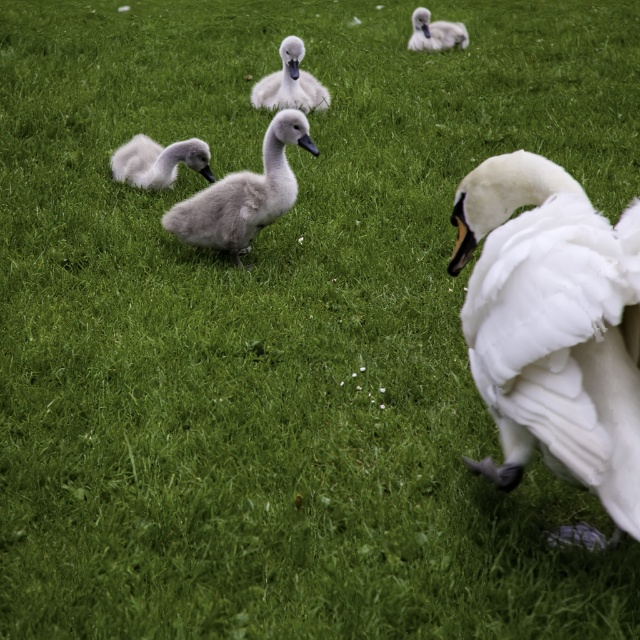
Consider the image. Does black glossy beak at center have a lesser width compared to gray matte beak at center?

No, black glossy beak at center is not thinner than gray matte beak at center.

Is point (301, 138) positioned after point (292, 72)?

No, (301, 138) is in front of (292, 72).

Locate an element on the screen. This screenshot has width=640, height=640. black glossy beak at center is located at coordinates (307, 145).

Describe the element at coordinates (554, 326) in the screenshot. This screenshot has height=640, width=640. I see `white fluffy swan at center` at that location.

Which is below, white fluffy swan at center or black glossy beak at center?

white fluffy swan at center

Between point (499, 205) and point (307, 140), which one is positioned in front?

Positioned in front is point (499, 205).

The height and width of the screenshot is (640, 640). Find the location of `white fluffy swan at center`. white fluffy swan at center is located at coordinates (554, 326).

Does soft gray swan at upper center have a lesser height compared to gray matte beak at center?

No.

Looking at this image, how far apart are soft gray swan at upper center and gray matte beak at center?

They are 3.64 meters apart.

Between point (444, 45) and point (296, 72), which one is positioned behind?

Point (444, 45)

Find the location of `soft gray swan at upper center`. soft gray swan at upper center is located at coordinates (435, 33).